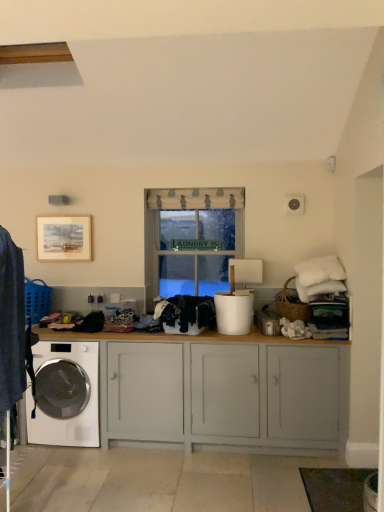
Question: Does white painted wood cabinet at center have a greater height compared to white fabric at center?

Choices:
 (A) yes
 (B) no

Answer: (B)

Question: Is white painted wood cabinet at center positioned before white fabric at center?

Choices:
 (A) yes
 (B) no

Answer: (A)

Question: Is white painted wood cabinet at center bigger than white fabric at center?

Choices:
 (A) no
 (B) yes

Answer: (B)

Question: Is white painted wood cabinet at center facing away from white fabric at center?

Choices:
 (A) yes
 (B) no

Answer: (B)

Question: From the image's perspective, is white painted wood cabinet at center on white fabric at center?

Choices:
 (A) yes
 (B) no

Answer: (B)

Question: Considering the relative positions of white glossy washing machine at lower left and white painted wood cabinet at center in the image provided, is white glossy washing machine at lower left to the left or to the right of white painted wood cabinet at center?

Choices:
 (A) left
 (B) right

Answer: (A)

Question: Is white glossy washing machine at lower left in front of or behind white painted wood cabinet at center in the image?

Choices:
 (A) behind
 (B) front

Answer: (A)

Question: In terms of width, does white glossy washing machine at lower left look wider or thinner when compared to white painted wood cabinet at center?

Choices:
 (A) thin
 (B) wide

Answer: (A)

Question: From the image's perspective, is white glossy washing machine at lower left positioned above or below white painted wood cabinet at center?

Choices:
 (A) below
 (B) above

Answer: (A)

Question: From the image's perspective, is black cotton clothes at center, which appears as the second clothing when viewed from the left, above or below white glossy washing machine at lower left?

Choices:
 (A) below
 (B) above

Answer: (B)

Question: Considering the positions of point (180, 296) and point (92, 419), is point (180, 296) closer or farther from the camera than point (92, 419)?

Choices:
 (A) farther
 (B) closer

Answer: (B)

Question: Looking at their shapes, would you say black cotton clothes at center, which is the first clothing from back to front, is wider or thinner than white glossy washing machine at lower left?

Choices:
 (A) thin
 (B) wide

Answer: (A)

Question: From a real-world perspective, relative to white glossy washing machine at lower left, is black cotton clothes at center, which appears as the first clothing when viewed from the right, vertically above or below?

Choices:
 (A) above
 (B) below

Answer: (A)

Question: Relative to black cotton clothes at center, which appears as the second clothing when viewed from the left, is white glossy washing machine at lower left in front or behind?

Choices:
 (A) front
 (B) behind

Answer: (B)

Question: From a real-world perspective, is white glossy washing machine at lower left positioned above or below black cotton clothes at center, which is the first clothing from back to front?

Choices:
 (A) below
 (B) above

Answer: (A)